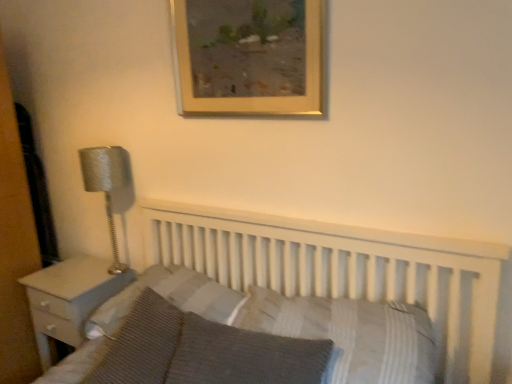
Question: Is knitted fabric pillow at lower left, marked as the fourth pillow in a right-to-left arrangement, to the left or to the right of striped fabric pillow at center, which ranks as the 3th pillow in right-to-left order, in the image?

Choices:
 (A) left
 (B) right

Answer: (A)

Question: Considering their positions, is knitted fabric pillow at lower left, acting as the first pillow starting from the left, located in front of or behind striped fabric pillow at center, which ranks as the 3th pillow in right-to-left order?

Choices:
 (A) behind
 (B) front

Answer: (B)

Question: Considering the real-world distances, which object is farthest from the silver textured lamp at left?

Choices:
 (A) striped fabric pillow at center, the second pillow from the left
 (B) gold wooden picture frame at upper center
 (C) knitted gray pillow at lower center, which is the third pillow in left-to-right order
 (D) white wood bed at center
 (E) white wood nightstand at left

Answer: (C)

Question: Which is nearer to the white wood bed at center?

Choices:
 (A) knitted fabric pillow at lower left, marked as the fourth pillow in a right-to-left arrangement
 (B) gold wooden picture frame at upper center
 (C) knitted gray pillow at lower center, marked as the second pillow in a right-to-left arrangement
 (D) silver textured lamp at left
 (E) striped fabric pillow at center, the second pillow from the left

Answer: (E)